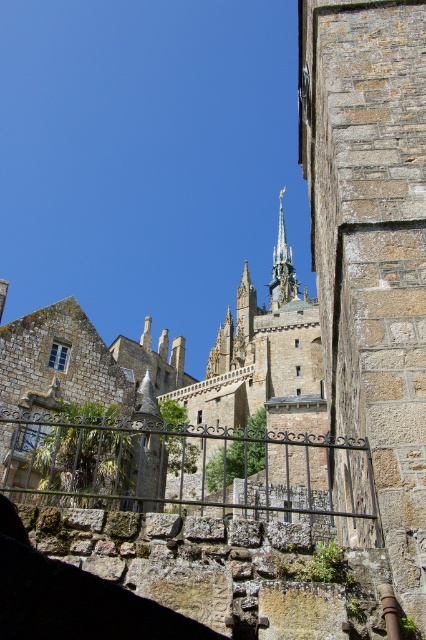
You are a tourist standing at the base of Mont Saint Michel, looking up at the stone medieval castle at center and the polished bronze spire at center. Which structure appears wider from your current viewpoint?

The stone medieval castle at center appears wider than the polished bronze spire at center because its width surpasses that of the spire.

You are a tourist standing at the base of Mont Saint Michel and want to take a photo that captures both the stone medieval castle at center and the polished bronze spire at center. Which object should you position closer to the top of your camera frame to ensure both are fully visible?

You should position the polished bronze spire at center closer to the top of your camera frame since it is taller than the stone medieval castle at center.